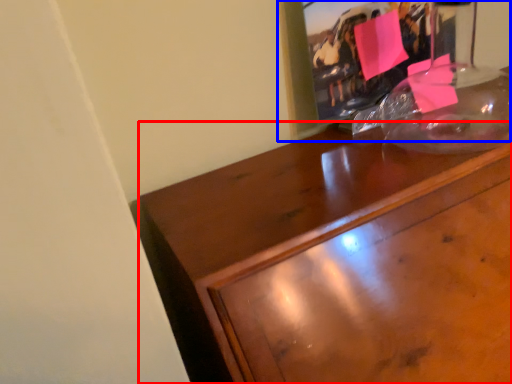
Question: Among these objects, which one is nearest to the camera, desk (highlighted by a red box) or picture frame (highlighted by a blue box)?

Choices:
 (A) desk
 (B) picture frame

Answer: (A)